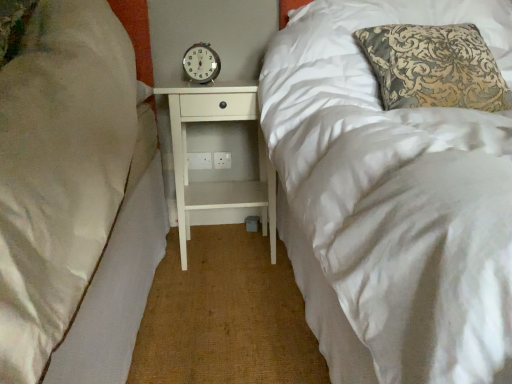
Question: Does white wood nightstand at center appear on the left side of metallic analog clock at center?

Choices:
 (A) yes
 (B) no

Answer: (B)

Question: Is white wood nightstand at center thinner than metallic analog clock at center?

Choices:
 (A) no
 (B) yes

Answer: (A)

Question: Is white wood nightstand at center bigger than metallic analog clock at center?

Choices:
 (A) no
 (B) yes

Answer: (B)

Question: Is white wood nightstand at center positioned with its back to metallic analog clock at center?

Choices:
 (A) no
 (B) yes

Answer: (A)

Question: Is white wood nightstand at center not close to metallic analog clock at center?

Choices:
 (A) no
 (B) yes

Answer: (A)

Question: From a real-world perspective, is white wood nightstand at center located beneath metallic analog clock at center?

Choices:
 (A) no
 (B) yes

Answer: (B)

Question: Is metallic analog clock at center at the left side of white wood nightstand at center?

Choices:
 (A) no
 (B) yes

Answer: (B)

Question: Is metallic analog clock at center smaller than white wood nightstand at center?

Choices:
 (A) no
 (B) yes

Answer: (B)

Question: Is metallic analog clock at center closer to the viewer compared to white wood nightstand at center?

Choices:
 (A) no
 (B) yes

Answer: (A)

Question: Is metallic analog clock at center thinner than white wood nightstand at center?

Choices:
 (A) no
 (B) yes

Answer: (B)

Question: Does metallic analog clock at center turn towards white wood nightstand at center?

Choices:
 (A) no
 (B) yes

Answer: (A)

Question: From a real-world perspective, is metallic analog clock at center beneath white wood nightstand at center?

Choices:
 (A) yes
 (B) no

Answer: (B)

Question: From the image's perspective, is metallic analog clock at center above or below white wood nightstand at center?

Choices:
 (A) above
 (B) below

Answer: (A)